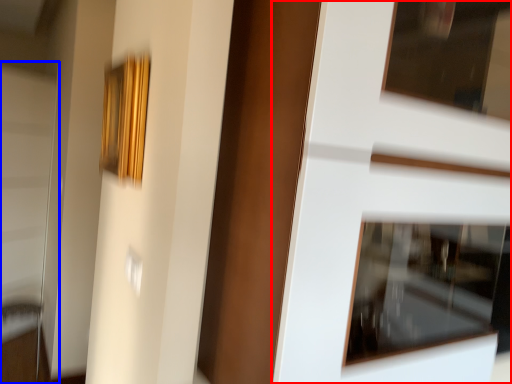
Question: Which object is further to the camera taking this photo, door (highlighted by a red box) or screen door (highlighted by a blue box)?

Choices:
 (A) door
 (B) screen door

Answer: (B)